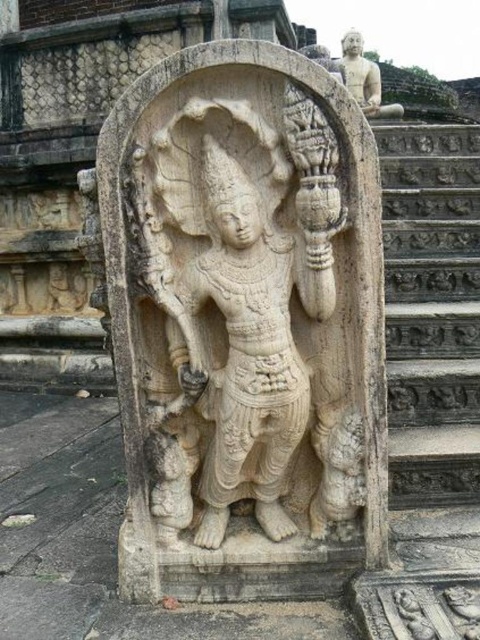
Question: Which point is farther to the camera?

Choices:
 (A) (358, 365)
 (B) (432, 385)

Answer: (B)

Question: Which of the following is the closest to the observer?

Choices:
 (A) white stone statue at center
 (B) gray stone stairs at right

Answer: (B)

Question: Does white stone statue at center have a lesser width compared to gray stone stairs at right?

Choices:
 (A) no
 (B) yes

Answer: (B)

Question: Where is white stone statue at center located in relation to gray stone stairs at right in the image?

Choices:
 (A) left
 (B) right

Answer: (A)

Question: Can you confirm if white stone statue at center is wider than gray stone stairs at right?

Choices:
 (A) no
 (B) yes

Answer: (A)